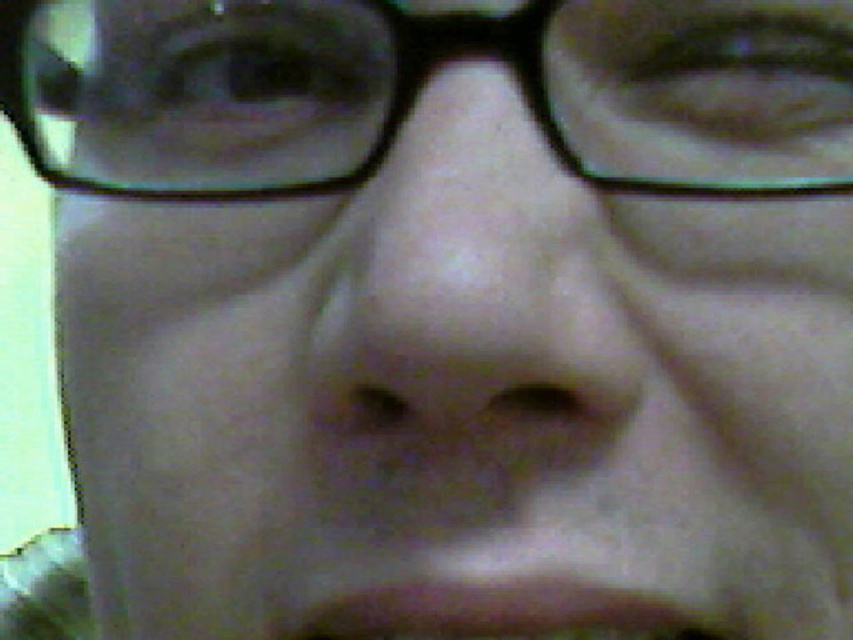
In the scene shown: You are a photographer trying to capture a closeup of a person. You need to ensure that the transparent plastic glasses at upper center and the brown matte mouth at lower center are both visible in the frame. Given their sizes, which object will occupy more space horizontally in the photo?

The transparent plastic glasses at upper center will occupy more space horizontally in the photo because its width surpasses that of the brown matte mouth at lower center.

You are a photographer trying to adjust the focus of your camera. You see a point at coordinates point (x=416, y=84) on the image. What object does this point correspond to?

The point at coordinates point (x=416, y=84) corresponds to the transparent plastic glasses at upper center.

You are a photographer trying to adjust the focus on a camera. The subject has transparent plastic glasses at upper center. Where should you focus to ensure the glasses are sharp?

You should focus on the transparent plastic glasses at upper center located at point (416, 84) to ensure they are sharp.